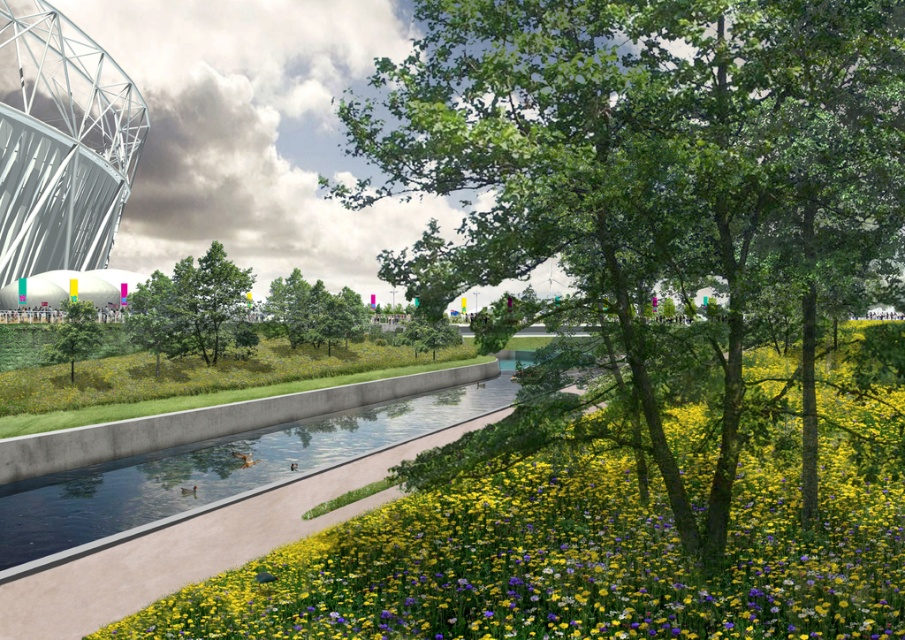
Between clear concrete water at center and green leafy tree at center, which one appears on the left side from the viewer's perspective?

green leafy tree at center

Identify the location of clear concrete water at center. The height and width of the screenshot is (640, 905). (218, 467).

Locate an element on the screen. clear concrete water at center is located at coordinates (218, 467).

Find the location of `clear concrete water at center`. clear concrete water at center is located at coordinates (218, 467).

Does yellow matte flower at center have a lesser height compared to green leafy tree at center?

Yes, yellow matte flower at center is shorter than green leafy tree at center.

Image resolution: width=905 pixels, height=640 pixels. In order to click on yellow matte flower at center in this screenshot , I will do `click(593, 540)`.

This screenshot has height=640, width=905. In order to click on yellow matte flower at center in this screenshot , I will do `click(593, 540)`.

Which of these two, green leafy tree at center or green matte tree at center, stands shorter?

green matte tree at center

Is point (169, 301) positioned after point (353, 308)?

That is False.

Image resolution: width=905 pixels, height=640 pixels. I want to click on green leafy tree at center, so click(x=189, y=305).